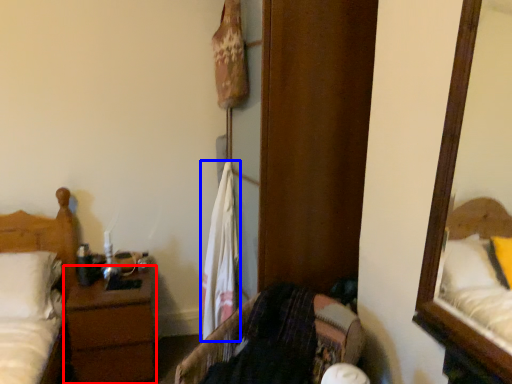
Question: Which point is closer to the camera, nightstand (highlighted by a red box) or laundry (highlighted by a blue box)?

Choices:
 (A) nightstand
 (B) laundry

Answer: (B)